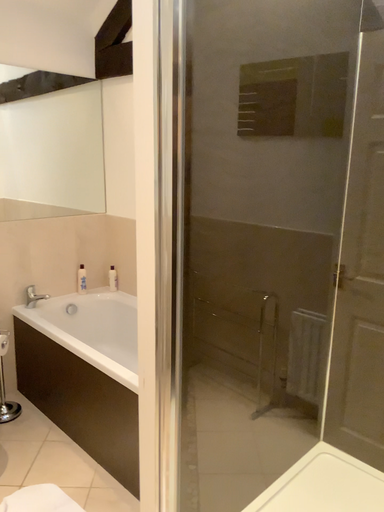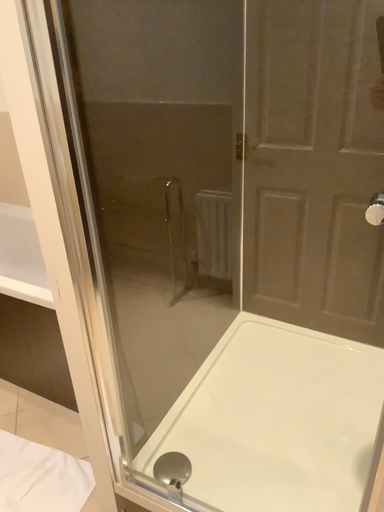
Question: How did the camera likely rotate when shooting the video?

Choices:
 (A) rotated right
 (B) rotated left

Answer: (A)